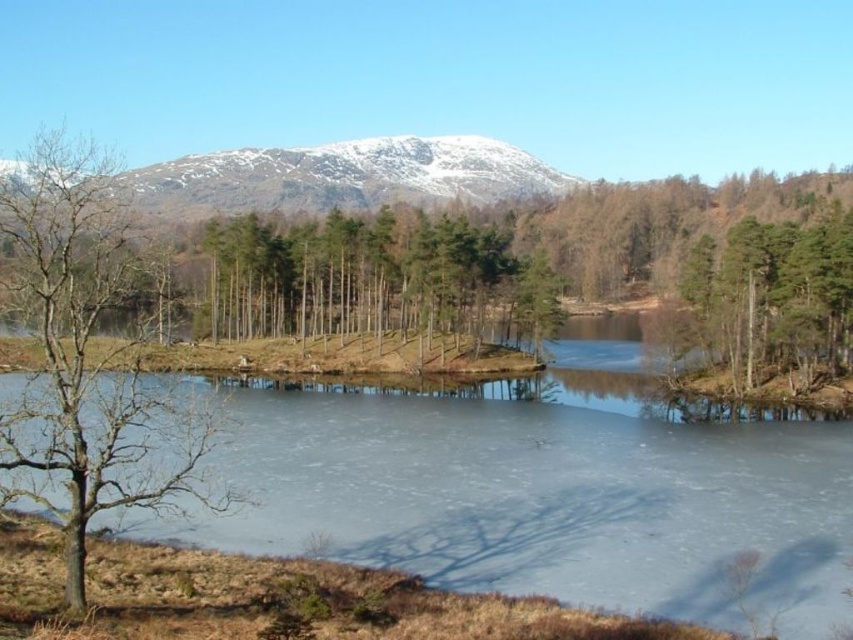
Does frozen ice at center appear on the left side of brown textured tree at right?

Indeed, frozen ice at center is positioned on the left side of brown textured tree at right.

Does point (720, 584) lie in front of point (849, 250)?

Yes, it is.

What do you see at coordinates (544, 486) in the screenshot? I see `frozen ice at center` at bounding box center [544, 486].

Image resolution: width=853 pixels, height=640 pixels. In order to click on frozen ice at center in this screenshot , I will do `click(544, 486)`.

Is point (274, 480) farther from camera compared to point (115, 236)?

Yes, point (274, 480) is farther from viewer.

Is point (549, 552) positioned before point (67, 198)?

No, (549, 552) is behind (67, 198).

Locate an element on the screen. This screenshot has width=853, height=640. frozen ice at center is located at coordinates (544, 486).

Which is in front, point (180, 477) or point (697, 376)?

Point (180, 477) is in front.

Which of these two, bare wood tree at left or brown textured tree at right, stands taller?

bare wood tree at left is taller.

Where is `bare wood tree at left`? bare wood tree at left is located at coordinates (86, 360).